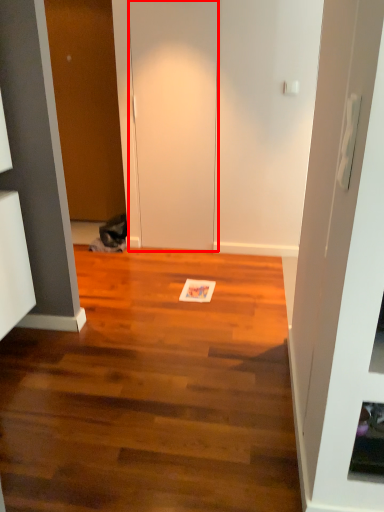
Question: Considering the relative positions of door (annotated by the red box) and door in the image provided, where is door (annotated by the red box) located with respect to the staircase?

Choices:
 (A) left
 (B) right

Answer: (B)